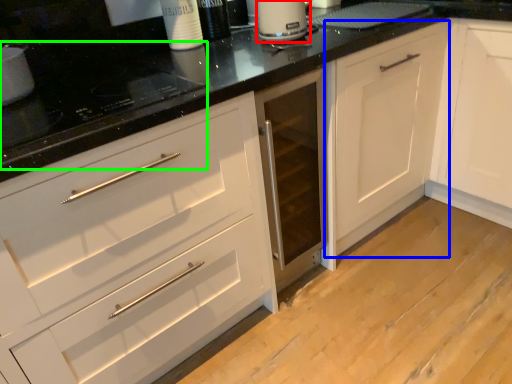
Question: Which object is positioned closest to kitchen appliance (highlighted by a red box)? Select from cabinetry (highlighted by a blue box) and appliance (highlighted by a green box).

Choices:
 (A) cabinetry
 (B) appliance

Answer: (A)